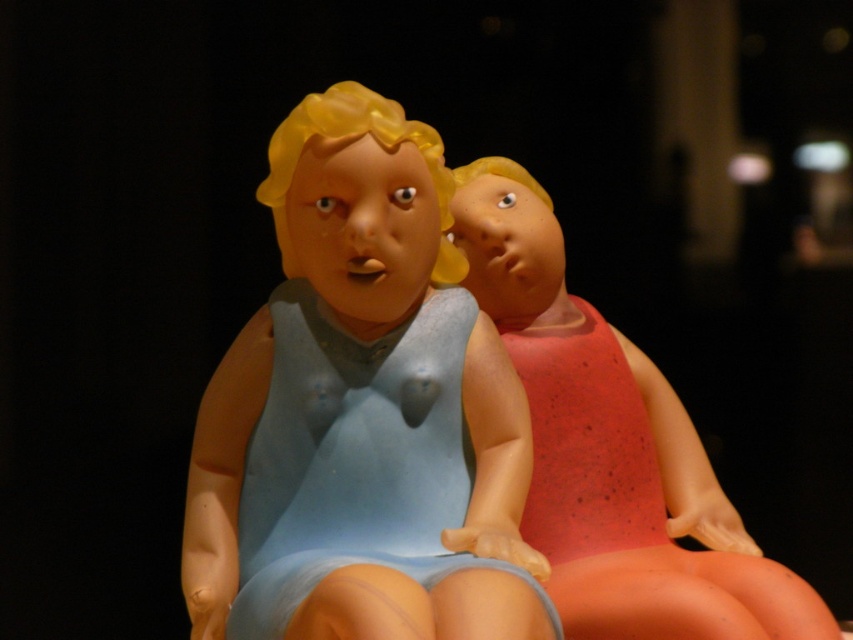
Which of these two, matte blue dress at center or matte red swimsuit at right, stands taller?

Answer: With more height is matte blue dress at center.

Does matte blue dress at center have a greater height compared to matte red swimsuit at right?

Yes, matte blue dress at center is taller than matte red swimsuit at right.

Between point (434, 520) and point (682, 600), which one is positioned in front?

Point (682, 600) is in front.

You are a GUI agent. You are given a task and a screenshot of the screen. Output one action in this format:
    pyautogui.click(x=<x>, y=<y>)
    Task: Click on the matte blue dress at center
    The image size is (853, 640).
    Given the screenshot: What is the action you would take?
    pyautogui.click(x=363, y=413)